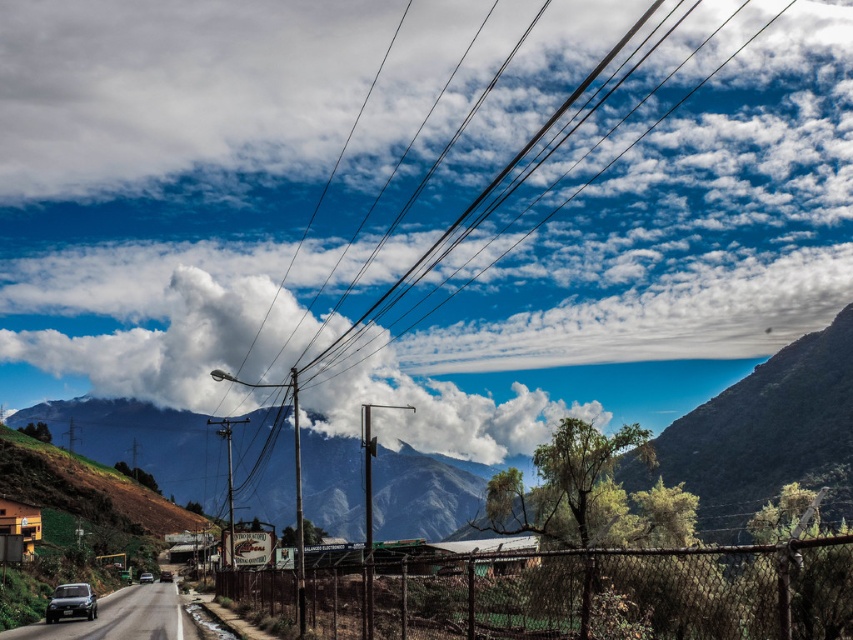
Question: Among these objects, which one is nearest to the camera?

Choices:
 (A) white fluffy cloud at upper center
 (B) shiny black car at lower left
 (C) metallic silver car at center

Answer: (B)

Question: Is white fluffy cloud at upper center below metallic silver car at center?

Choices:
 (A) no
 (B) yes

Answer: (A)

Question: Which object is closer to the camera taking this photo?

Choices:
 (A) shiny black car at lower left
 (B) white fluffy cloud at upper center

Answer: (A)

Question: Estimate the real-world distances between objects in this image. Which object is closer to the white fluffy cloud at upper center?

Choices:
 (A) shiny black car at lower left
 (B) metallic silver car at center

Answer: (B)

Question: Does shiny black car at lower left have a lesser width compared to metallic silver car at center?

Choices:
 (A) yes
 (B) no

Answer: (A)

Question: Does white fluffy cloud at upper center have a lesser width compared to rugged stone mountain at center?

Choices:
 (A) yes
 (B) no

Answer: (B)